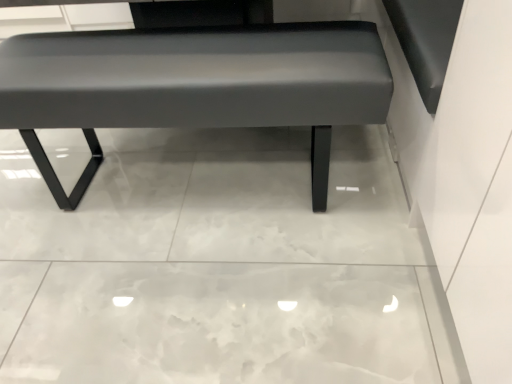
Locate an element on the screen. The height and width of the screenshot is (384, 512). matte gray bench at center is located at coordinates (194, 85).

Describe the element at coordinates (194, 85) in the screenshot. I see `matte gray bench at center` at that location.

Find the location of `matte gray bench at center`. matte gray bench at center is located at coordinates (194, 85).